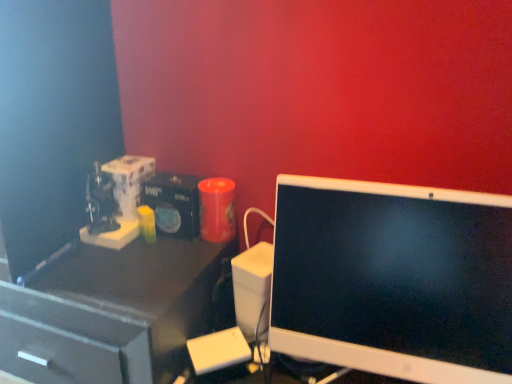
Measure the distance between white glossy computer monitor at right and camera.

The distance of white glossy computer monitor at right from camera is 27.42 inches.

The image size is (512, 384). What do you see at coordinates (393, 279) in the screenshot? I see `white glossy computer monitor at right` at bounding box center [393, 279].

I want to click on white glossy computer monitor at right, so click(393, 279).

What are the coordinates of `matte black desk at left` in the screenshot? It's located at click(112, 312).

What do you see at coordinates (112, 312) in the screenshot?
I see `matte black desk at left` at bounding box center [112, 312].

At what (x,y) coordinates should I click in order to perform the action: click on white glossy computer monitor at right. Please return your answer as a coordinate pair (x, y). The height and width of the screenshot is (384, 512). Looking at the image, I should click on (393, 279).

Which is more to the right, matte black desk at left or white glossy computer monitor at right?

white glossy computer monitor at right.

Which object is closer to the camera taking this photo, matte black desk at left or white glossy computer monitor at right?

white glossy computer monitor at right is more forward.

Between point (154, 277) and point (295, 214), which one is positioned in front?

The point (295, 214) is closer to the camera.

From the image's perspective, is matte black desk at left located above white glossy computer monitor at right?

Actually, matte black desk at left appears below white glossy computer monitor at right in the image.

From a real-world perspective, is matte black desk at left positioned above or below white glossy computer monitor at right?

Clearly, from a real-world perspective, matte black desk at left is below white glossy computer monitor at right.

Between matte black desk at left and white glossy computer monitor at right, which one has smaller width?

white glossy computer monitor at right is thinner.

Does matte black desk at left have a greater height compared to white glossy computer monitor at right?

Indeed, matte black desk at left has a greater height compared to white glossy computer monitor at right.

Who is bigger, matte black desk at left or white glossy computer monitor at right?

matte black desk at left.

Is white glossy computer monitor at right a part of matte black desk at left?

No.

Is matte black desk at left not near white glossy computer monitor at right?

No, matte black desk at left is in close proximity to white glossy computer monitor at right.

Is white glossy computer monitor at right at the back of matte black desk at left?

That's not correct — matte black desk at left is not looking away from white glossy computer monitor at right.

The width and height of the screenshot is (512, 384). Identify the location of computer monitor above the matte black desk at left (from the image's perspective). (393, 279).

Looking at this image, which is more to the right, white glossy computer monitor at right or matte black desk at left?

white glossy computer monitor at right.

In the image, is white glossy computer monitor at right positioned in front of or behind matte black desk at left?

white glossy computer monitor at right is in front of matte black desk at left.

Between point (310, 243) and point (28, 321), which one is positioned in front?

The point (310, 243) is more forward.

From the image's perspective, is white glossy computer monitor at right located above or below matte black desk at left?

Clearly, from the image's perspective, white glossy computer monitor at right is above matte black desk at left.

From a real-world perspective, is white glossy computer monitor at right physically located above or below matte black desk at left?

In terms of real-world spatial position, white glossy computer monitor at right is above matte black desk at left.

Looking at this image, which object is thinner, white glossy computer monitor at right or matte black desk at left?

white glossy computer monitor at right is thinner.

Considering the sizes of objects white glossy computer monitor at right and matte black desk at left in the image provided, who is shorter, white glossy computer monitor at right or matte black desk at left?

Standing shorter between the two is white glossy computer monitor at right.

Who is bigger, white glossy computer monitor at right or matte black desk at left?

matte black desk at left is bigger.

Is white glossy computer monitor at right located outside matte black desk at left?

Yes, white glossy computer monitor at right is located beyond the bounds of matte black desk at left.

Is white glossy computer monitor at right positioned far away from matte black desk at left?

They are positioned close to each other.

Does white glossy computer monitor at right turn towards matte black desk at left?

No, white glossy computer monitor at right is not facing towards matte black desk at left.

How many degrees apart are the facing directions of white glossy computer monitor at right and matte black desk at left?

The angle between the facing direction of white glossy computer monitor at right and the facing direction of matte black desk at left is 4.79 degrees.

Where is `desk located underneath the white glossy computer monitor at right (from a real-world perspective)`? The image size is (512, 384). desk located underneath the white glossy computer monitor at right (from a real-world perspective) is located at coordinates [x=112, y=312].

This screenshot has height=384, width=512. I want to click on computer monitor in front of the matte black desk at left, so click(393, 279).

This screenshot has height=384, width=512. In order to click on computer monitor that appears above the matte black desk at left (from the image's perspective) in this screenshot , I will do `click(393, 279)`.